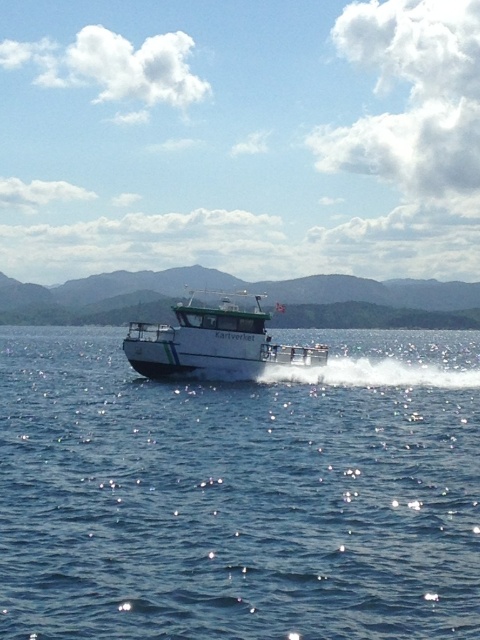
You are a sailor on a small boat and need to navigate between the blue water at center and the white glossy boat at center. Given that your boat requires a minimum of 80 feet of clearance to pass safely, can you safely navigate through the space between them?

The distance between the blue water at center and the white glossy boat at center is 82.60 feet, which exceeds the minimum required clearance of 80 feet. Therefore, you can safely navigate through the space between them.

You are standing on the deck of the Kartverket boat and want to move from the point at coordinates point (328, 595) to the point at coordinates point (283, 355). Which direction should you move to get closer to the boat?

You should move towards point (283, 355) because it is farther from the viewer than point (328, 595), so moving towards it would take you away from the boat. Wait, that seems contradictory. Let me think again. The question asks to move closer to the boat. If point A is closer to the viewer than point B, then moving from A to B would mean moving away from the viewer, hence away from the boat. To get closer to the boat, you need to move in the opposite direction, towards point A. Hmm, maybe I need to reex